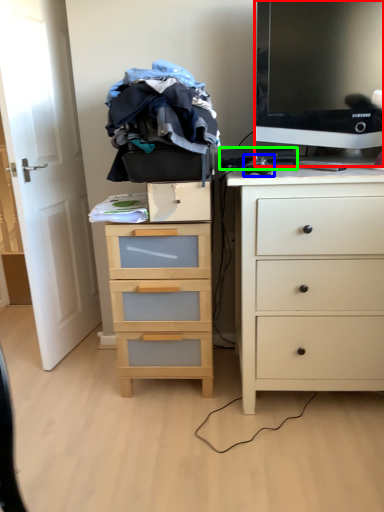
Question: Considering the real-world distances, which object is farthest from television (highlighted by a red box)? computer mouse (highlighted by a blue box) or computer keyboard (highlighted by a green box)?

Choices:
 (A) computer mouse
 (B) computer keyboard

Answer: (A)